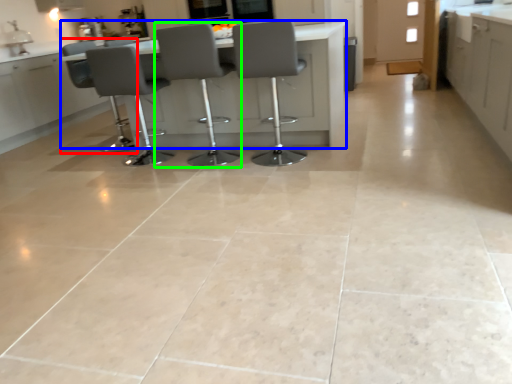
Question: Considering the real-world distances, which object is closest to chair (highlighted by a red box)? table (highlighted by a blue box) or chair (highlighted by a green box).

Choices:
 (A) table
 (B) chair

Answer: (A)